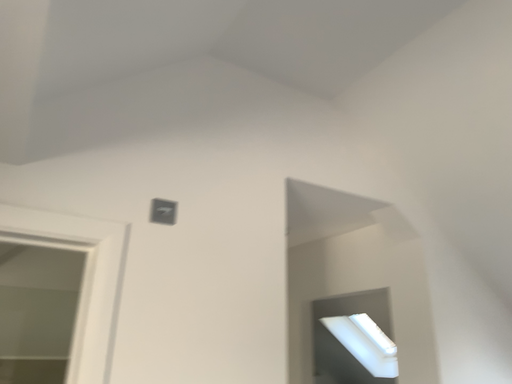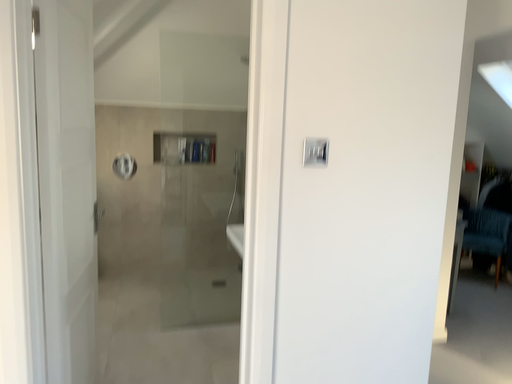
Question: Which way did the camera rotate in the video?

Choices:
 (A) rotated downward
 (B) rotated upward

Answer: (A)